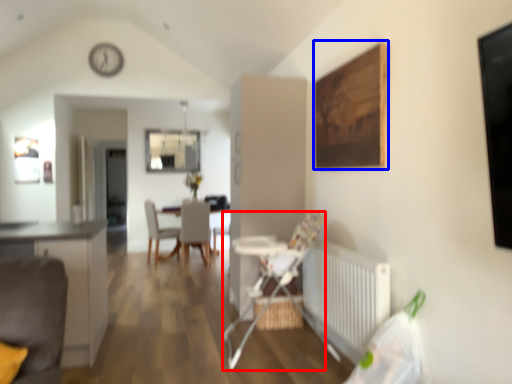
Question: Which point is further to the camera, armchair (highlighted by a red box) or picture frame (highlighted by a blue box)?

Choices:
 (A) armchair
 (B) picture frame

Answer: (A)